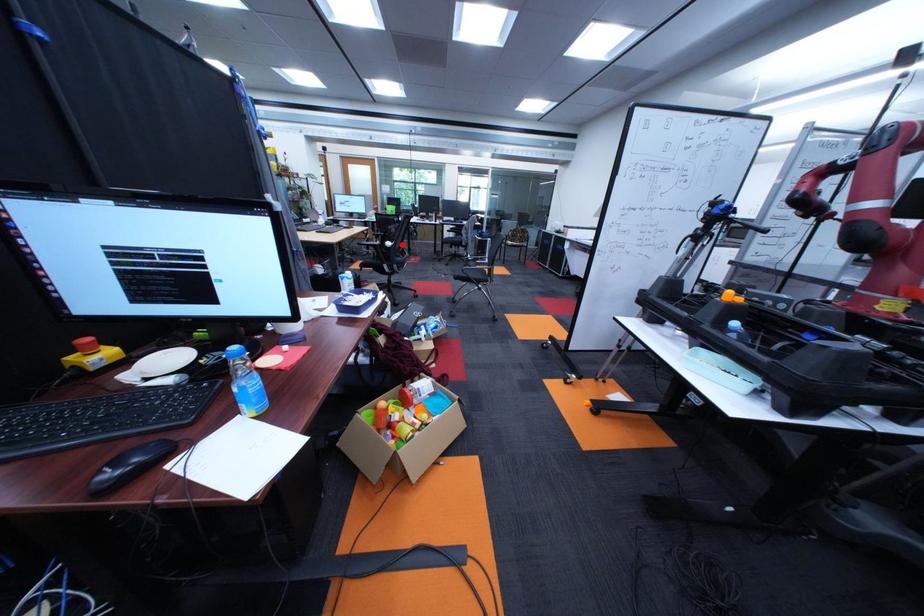
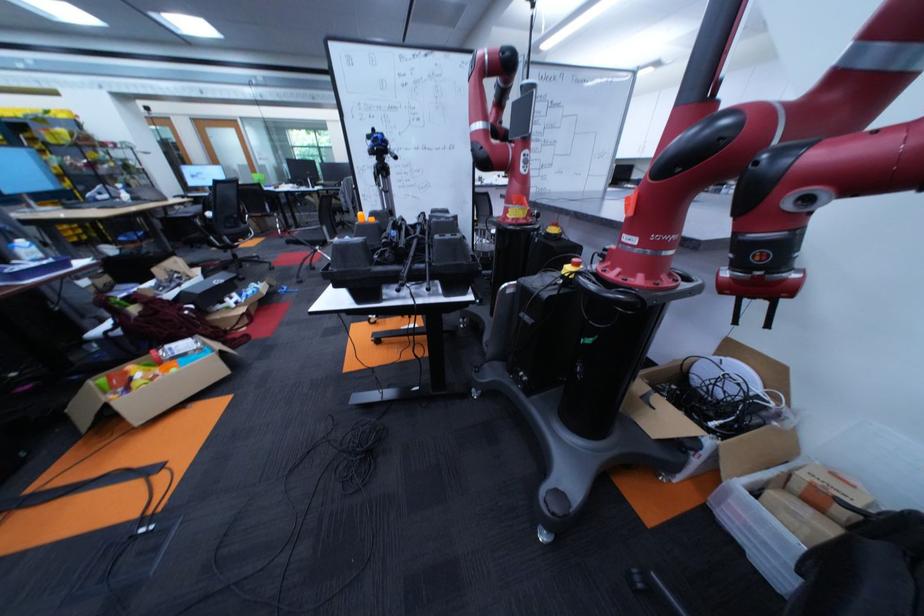
Question: A red point is marked in image1. In image2, is the corresponding 3D point closer to the camera or farther? Reply with the corresponding letter.

Choices:
 (A) The corresponding 3D point is closer.
 (B) The corresponding 3D point is farther.

Answer: (B)